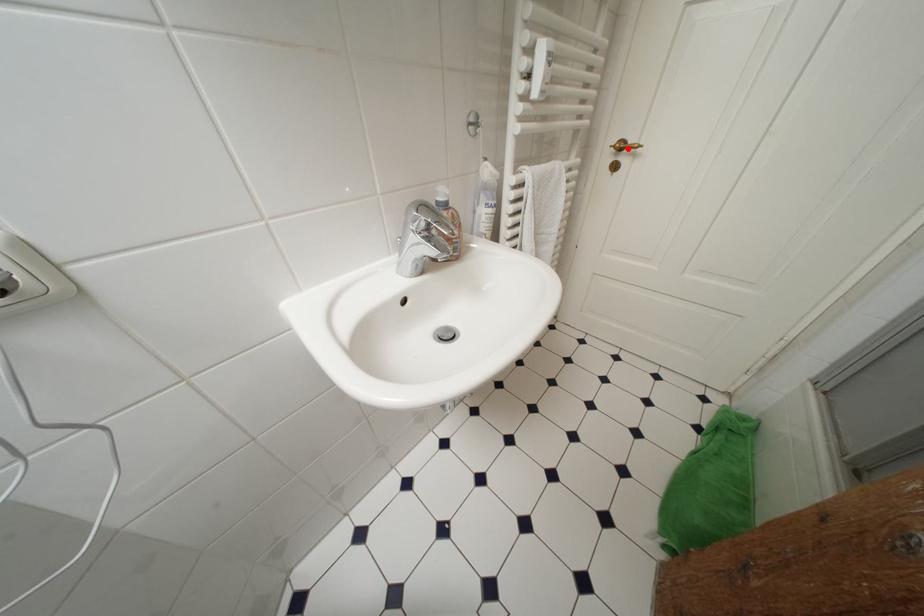
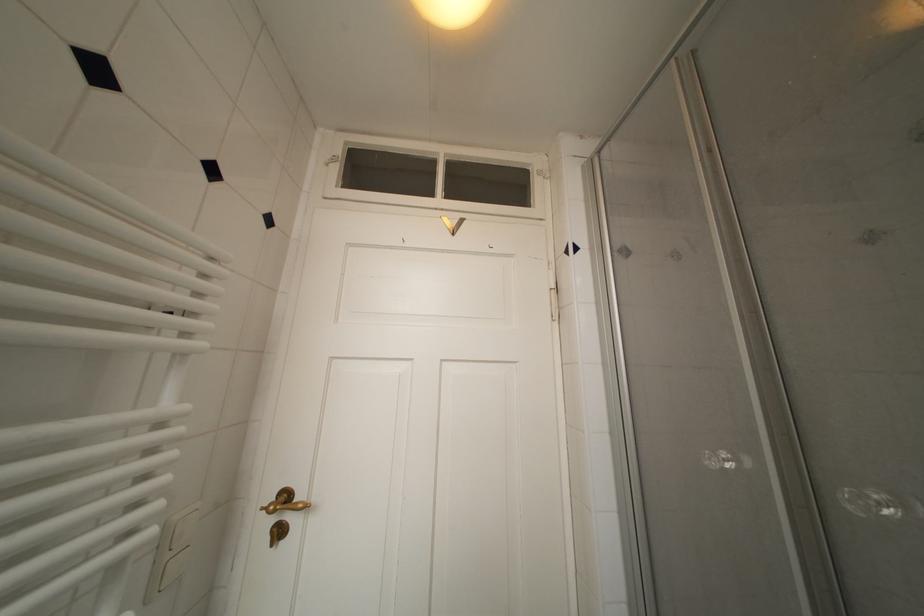
Find the pixel in the second image that matches the highlighted location in the first image.

(293, 500)